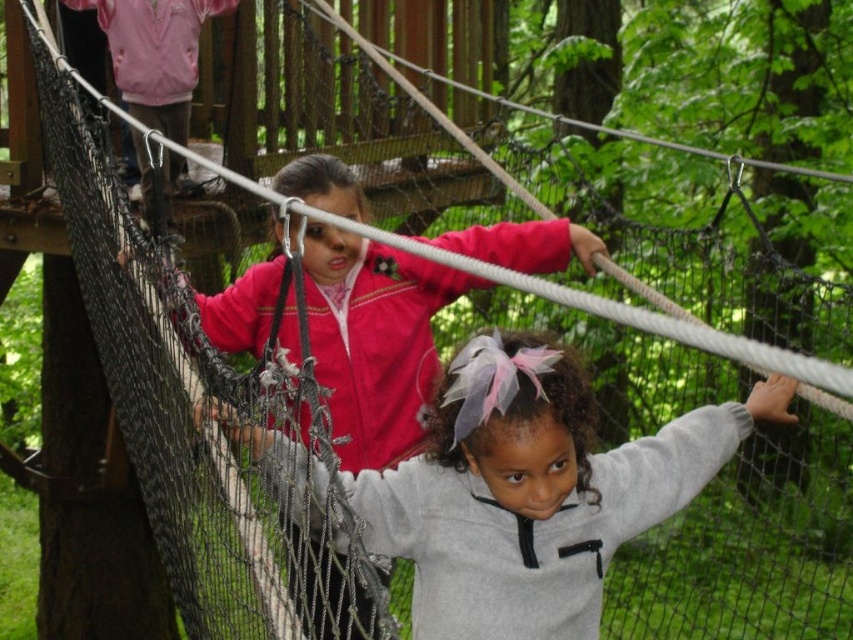
You are a parent watching your children on a rope bridge in a forest playground. You see the gray fleece jacket at center and the pink fleece jacket at upper center. Which child is closer to you?

The gray fleece jacket at center is closer to you because it is positioned at the center, while the pink fleece jacket at upper center is further away.

You are a park ranger assessing safety equipment. The rope bridge has a minimum width requirement of 1.2 meters for the netting. You observe the gray fleece jacket at center and the pink fleece jacket at upper center. Which jacket is wider and would be more likely to require a wider netting section?

The pink fleece jacket at upper center is wider than the gray fleece jacket at center, so it would more likely require a wider netting section.